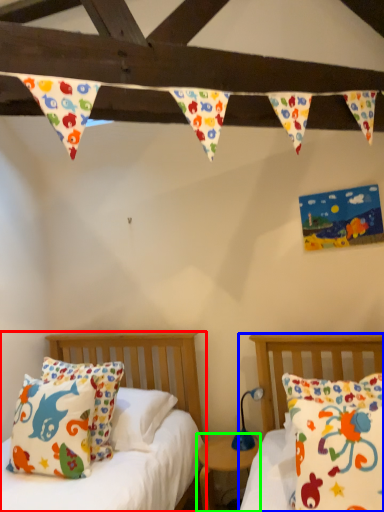
Question: Which object is positioned closest to bed (highlighted by a red box)? Select from bed (highlighted by a blue box) and nightstand (highlighted by a green box).

Choices:
 (A) bed
 (B) nightstand

Answer: (B)